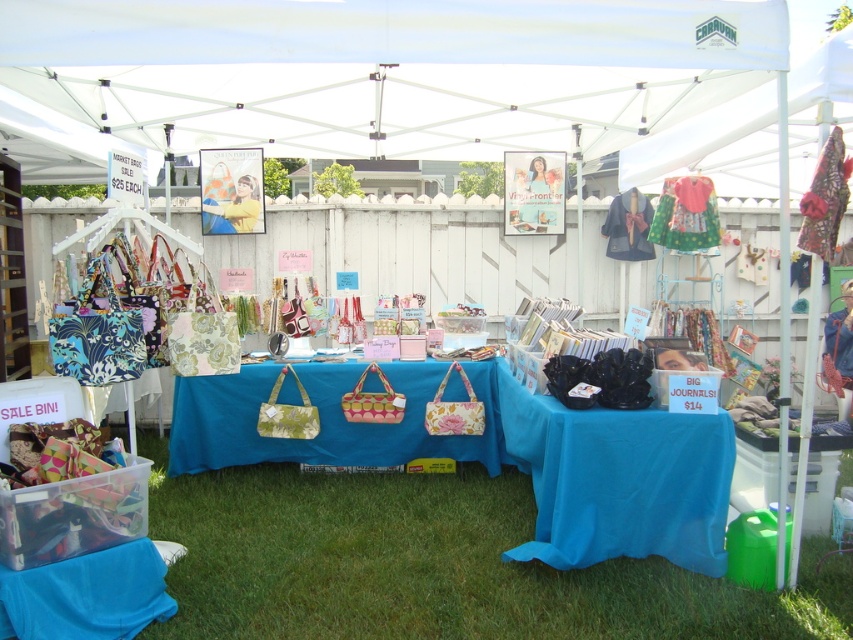
Between point (657, 122) and point (659, 493), which one is positioned in front?

Point (659, 493) is more forward.

Is white fabric canopy at upper center positioned behind blue fabric table at center?

Yes, white fabric canopy at upper center is further from the viewer.

Who is more distant from viewer, (636, 38) or (581, 429)?

Point (581, 429)

Find the location of a particular element. This screenshot has width=853, height=640. white fabric canopy at upper center is located at coordinates [x=387, y=68].

Looking at this image, between green grass at lower center and floral fabric handbags at center, which one is positioned lower?

green grass at lower center is lower down.

Is point (141, 449) closer to viewer compared to point (218, 380)?

No, (141, 449) is further to viewer.

This screenshot has height=640, width=853. I want to click on green grass at lower center, so click(434, 564).

Between white fabric canopy at upper center and green grass at lower center, which one has more height?

white fabric canopy at upper center

Who is shorter, white fabric canopy at upper center or green grass at lower center?

Standing shorter between the two is green grass at lower center.

Locate an element on the screen. white fabric canopy at upper center is located at coordinates (387, 68).

In order to click on white fabric canopy at upper center in this screenshot , I will do click(x=387, y=68).